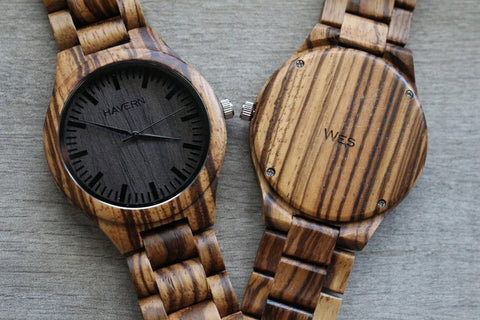
The width and height of the screenshot is (480, 320). Identify the location of screws. (270, 172), (300, 64), (411, 93), (381, 202).